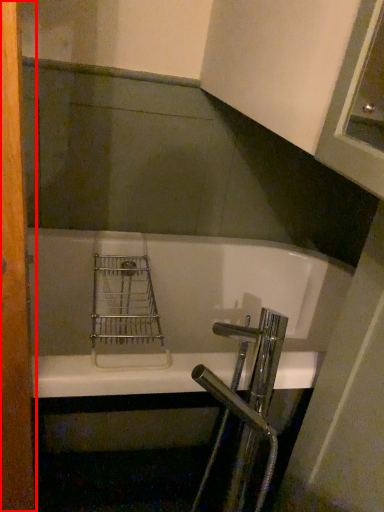
Question: From the image's perspective, where is screen door (annotated by the red box) located relative to bathtub?

Choices:
 (A) below
 (B) above

Answer: (B)